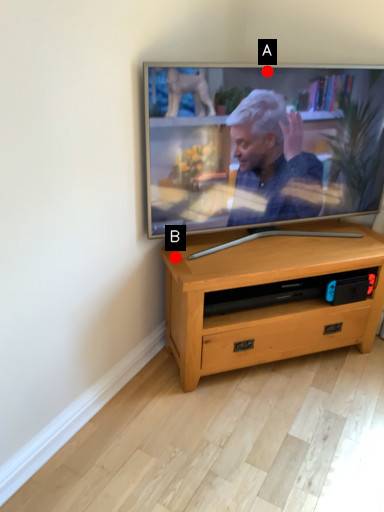
Question: Two points are circled on the image, labeled by A and B beside each circle. Among these points, which one is nearest to the camera?

Choices:
 (A) A is closer
 (B) B is closer

Answer: (A)